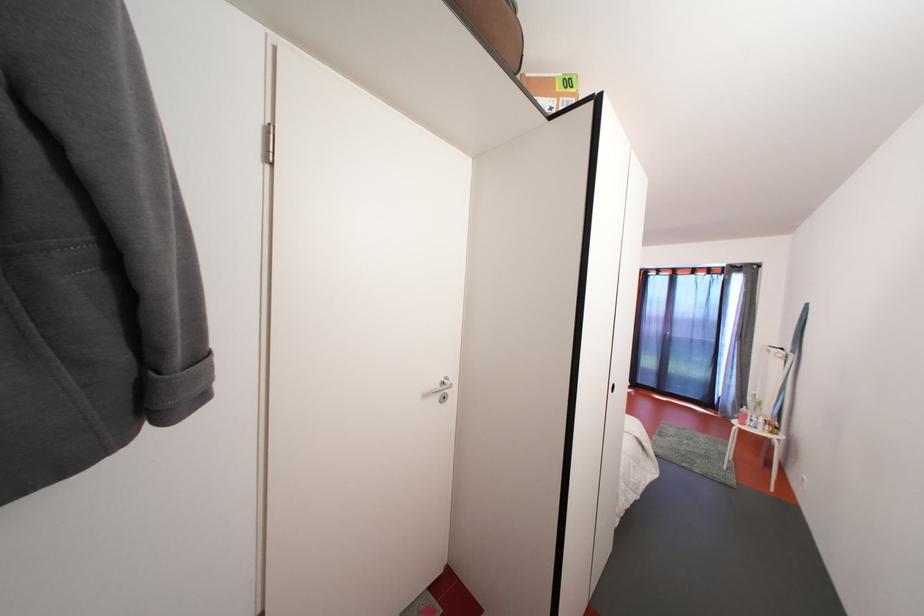
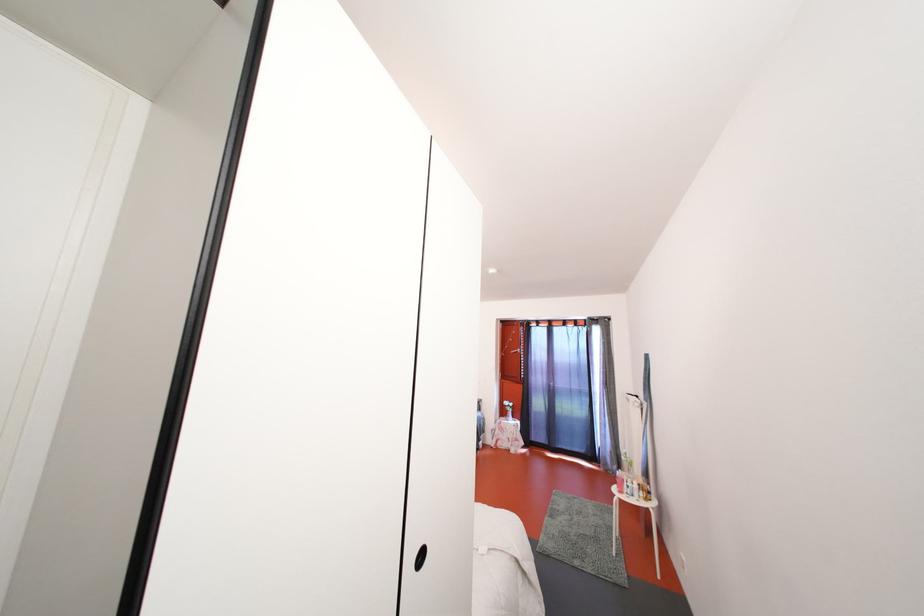
In the second image, find the point that corresponds to point (740, 419) in the first image.

(619, 469)